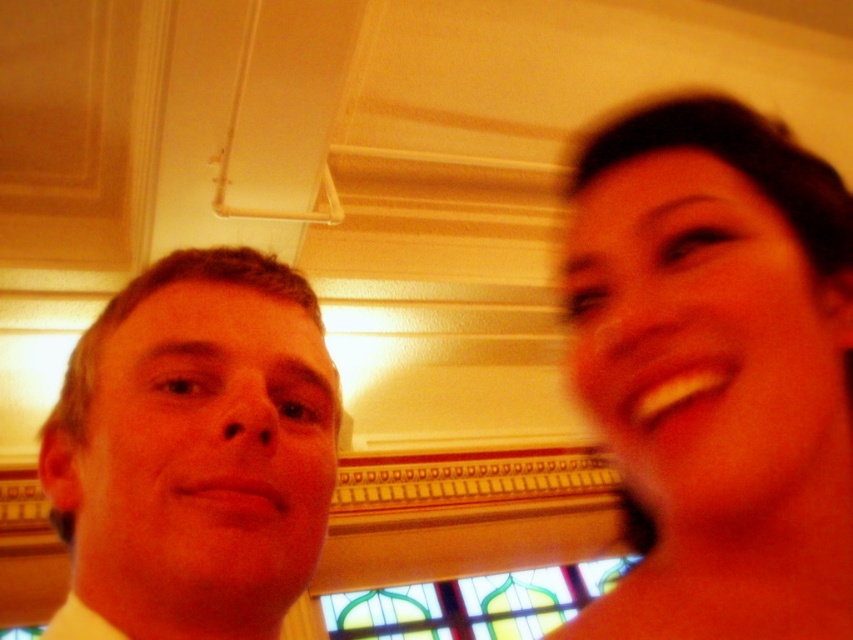
Does matte yellow shirt at left appear on the right side of white cotton dress shirt at left?

Yes, matte yellow shirt at left is to the right of white cotton dress shirt at left.

Based on the photo, can you confirm if matte yellow shirt at left is bigger than white cotton dress shirt at left?

Correct, matte yellow shirt at left is larger in size than white cotton dress shirt at left.

You are a GUI agent. You are given a task and a screenshot of the screen. Output one action in this format:
    pyautogui.click(x=<x>, y=<y>)
    Task: Click on the matte yellow shirt at left
    The height and width of the screenshot is (640, 853).
    Given the screenshot: What is the action you would take?
    pyautogui.click(x=196, y=449)

Image resolution: width=853 pixels, height=640 pixels. I want to click on matte yellow shirt at left, so click(x=196, y=449).

Looking at this image, which of these two, smooth skin at right or matte yellow shirt at left, stands taller?

Standing taller between the two is smooth skin at right.

Is point (767, 410) farther from viewer compared to point (224, 531)?

Yes, it is behind point (224, 531).

Identify the location of smooth skin at right. This screenshot has height=640, width=853. (717, 371).

Where is `smooth skin at right`? The width and height of the screenshot is (853, 640). smooth skin at right is located at coordinates (717, 371).

Can you confirm if stained glass at center is positioned below white cotton dress shirt at left?

Yes.

Does point (548, 566) come behind point (76, 605)?

That is True.

Between point (440, 595) and point (76, 627), which one is positioned behind?

The point (440, 595) is behind.

Locate an element on the screen. Image resolution: width=853 pixels, height=640 pixels. stained glass at center is located at coordinates (474, 604).